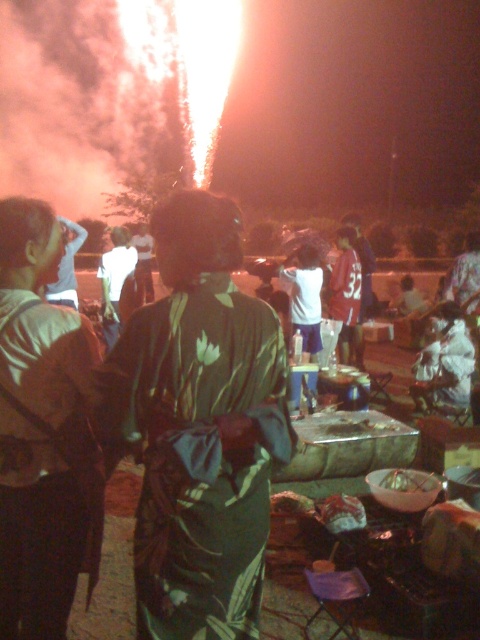
You are standing in the scene and want to take a photo of both point (351,228) and point (141,227). Which point should you focus on first to ensure both are in clear view?

You should focus on point (351,228) first because it is closer to the camera than point (141,227). This ensures that both points will be in focus as the camera adjusts for the closer object.

You are at the outdoor event and want to grab the shiny metallic bowl at center to serve more snacks. However, there is a matte green dress at center in the way. Based on their positions, can you reach the bowl without moving the dress?

The matte green dress at center is to the left of the shiny metallic bowl at center, so you can reach the bowl by moving to its right side without disturbing the dress.